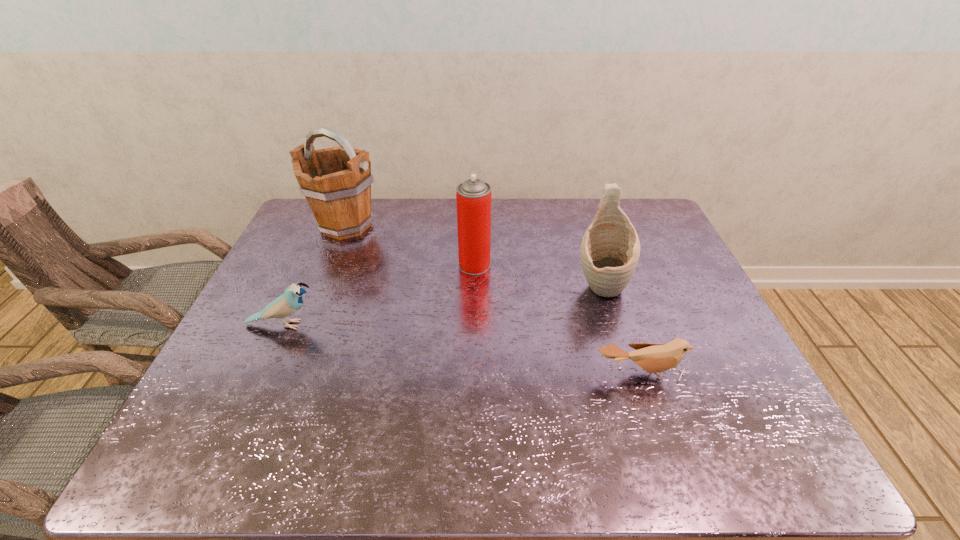
The width and height of the screenshot is (960, 540). What are the coordinates of `empty location between the taller bird and the bucket` in the screenshot? It's located at (315, 275).

Locate an element on the screen. The height and width of the screenshot is (540, 960). empty space between the farthest object and the aerosol can is located at coordinates (410, 245).

Find the location of a particular element. The height and width of the screenshot is (540, 960). object that is the closest to the bucket is located at coordinates (473, 197).

Point out which object is positioned as the third nearest to the right bird. Please provide its 2D coordinates. Your answer should be formatted as a tuple, i.e. [(x, y)], where the tuple contains the x and y coordinates of a point satisfying the conditions above.

[(291, 301)]